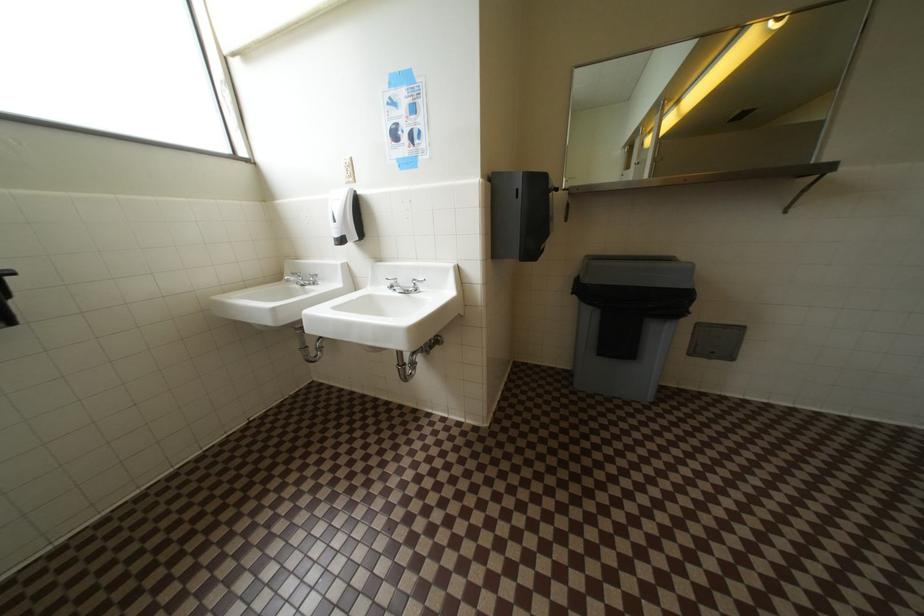
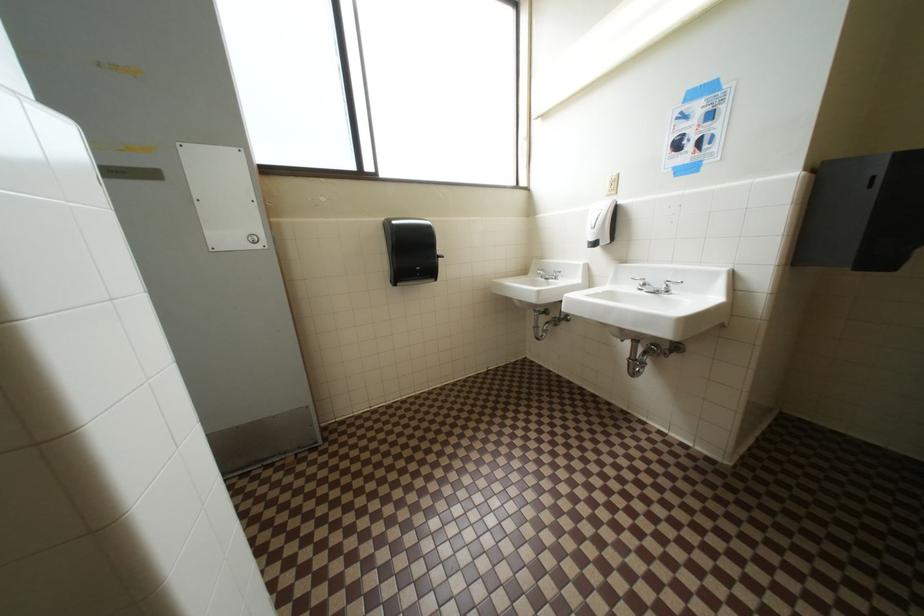
Question: Based on the continuous images, in which direction is the camera rotating? Reply with the corresponding letter.

Choices:
 (A) Left
 (B) Right
 (C) Up
 (D) Down

Answer: (A)